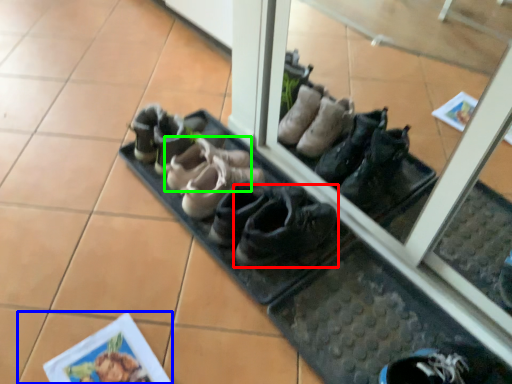
Question: Which object is the farthest from footwear (highlighted by a red box)? Choose among these: tile (highlighted by a blue box) or footwear (highlighted by a green box).

Choices:
 (A) tile
 (B) footwear

Answer: (A)